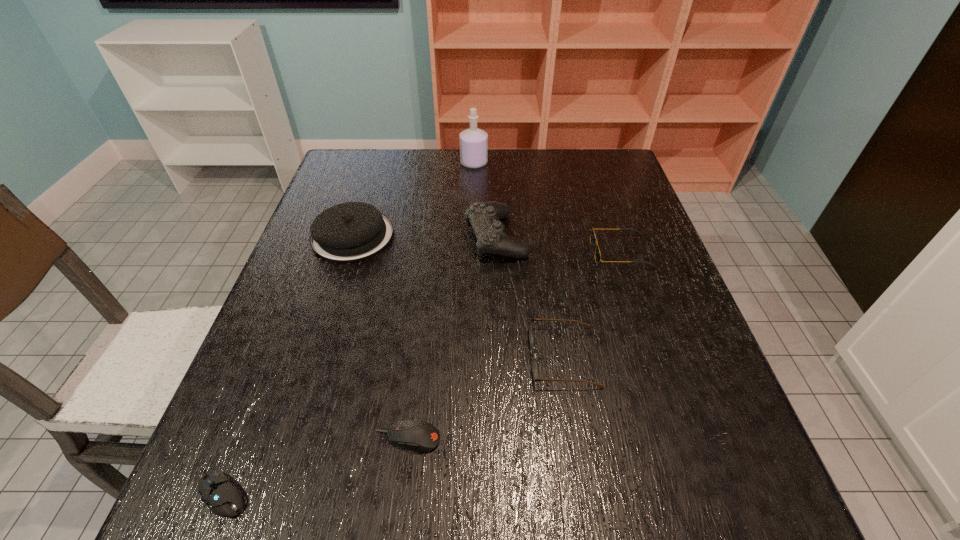
You are a GUI agent. You are given a task and a screenshot of the screen. Output one action in this format:
    pyautogui.click(x=<x>, y=<y>)
    Task: Click on the farthest object
    The width and height of the screenshot is (960, 540).
    Given the screenshot: What is the action you would take?
    pyautogui.click(x=473, y=141)

I want to click on the tallest object, so click(x=473, y=141).

You are a GUI agent. You are given a task and a screenshot of the screen. Output one action in this format:
    pyautogui.click(x=<x>, y=<y>)
    Task: Click on the control
    
    Given the screenshot: What is the action you would take?
    pyautogui.click(x=490, y=233)

At what (x,y) coordinates should I click in order to perform the action: click on pancake. Please return your answer as a coordinate pair (x, y). Looking at the image, I should click on (352, 231).

Identify the location of the fourth shortest object. The height and width of the screenshot is (540, 960). (593, 239).

Image resolution: width=960 pixels, height=540 pixels. Identify the location of the rightmost object. (593, 239).

Locate an element on the screen. This screenshot has height=540, width=960. the fifth farthest object is located at coordinates (530, 319).

Identify the location of the farther computer mouse. The height and width of the screenshot is (540, 960). (420, 436).

At what (x,y) coordinates should I click in order to perform the action: click on the fifth object from right to left. Please return your answer as a coordinate pair (x, y). Looking at the image, I should click on (420, 436).

Where is `the nearest object`? Image resolution: width=960 pixels, height=540 pixels. the nearest object is located at coordinates (222, 497).